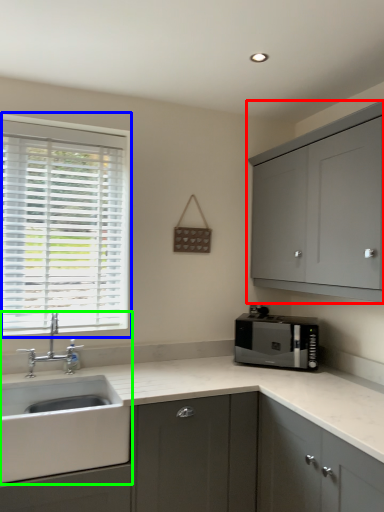
Question: Estimate the real-world distances between objects in this image. Which object is closer to cabinetry (highlighted by a red box), window (highlighted by a blue box) or sink (highlighted by a green box)?

Choices:
 (A) window
 (B) sink

Answer: (A)